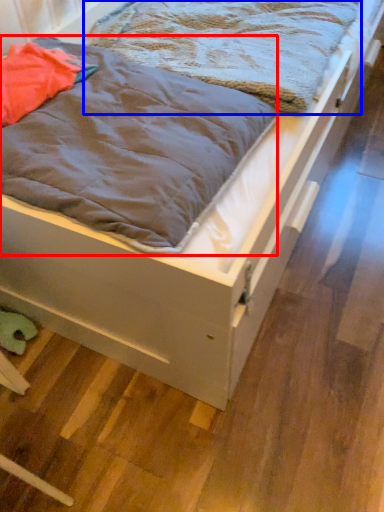
Question: Which point is further to the camera, blanket (highlighted by a red box) or blanket (highlighted by a blue box)?

Choices:
 (A) blanket
 (B) blanket

Answer: (B)